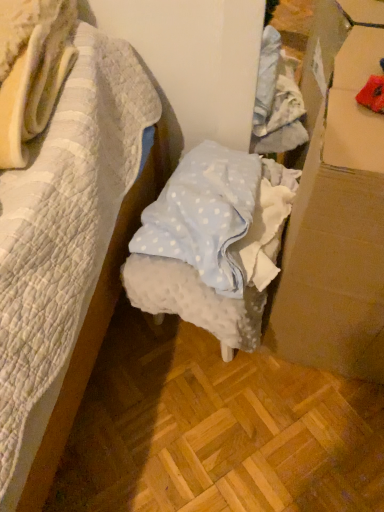
The width and height of the screenshot is (384, 512). What do you see at coordinates (337, 207) in the screenshot? I see `cardboard at right` at bounding box center [337, 207].

Where is `cardboard at right`? The height and width of the screenshot is (512, 384). cardboard at right is located at coordinates (337, 207).

Describe the element at coordinates (212, 243) in the screenshot. The width and height of the screenshot is (384, 512). I see `white dotted fabric at center` at that location.

Locate an element on the screen. white dotted fabric at center is located at coordinates (212, 243).

Identify the location of cardboard at right. (337, 207).

Is white dotted fabric at center to the left of cardboard at right from the viewer's perspective?

Indeed, white dotted fabric at center is positioned on the left side of cardboard at right.

In the image, is white dotted fabric at center positioned in front of or behind cardboard at right?

Visually, white dotted fabric at center is located behind cardboard at right.

Is point (212, 210) in front of point (342, 142)?

No, it is behind (342, 142).

From the image's perspective, is white dotted fabric at center on top of cardboard at right?

Indeed, from the image's perspective, white dotted fabric at center is shown above cardboard at right.

From a real-world perspective, which is physically below, white dotted fabric at center or cardboard at right?

white dotted fabric at center, from a real-world perspective.

Is white dotted fabric at center wider or thinner than cardboard at right?

white dotted fabric at center is wider than cardboard at right.

Is white dotted fabric at center shorter than cardboard at right?

Yes.

Between white dotted fabric at center and cardboard at right, which one has larger size?

cardboard at right.

Does white dotted fabric at center contain cardboard at right?

No, cardboard at right is not surrounded by white dotted fabric at center.

Are white dotted fabric at center and cardboard at right beside each other?

No, white dotted fabric at center is not with cardboard at right.

Could you tell me if white dotted fabric at center is turned towards cardboard at right?

No, white dotted fabric at center is not facing towards cardboard at right.

The image size is (384, 512). Identify the location of cardboard box above the white dotted fabric at center (from a real-world perspective). (337, 207).

Looking at this image, which object is positioned more to the right, cardboard at right or white dotted fabric at center?

Positioned to the right is cardboard at right.

In the image, is cardboard at right positioned in front of or behind white dotted fabric at center?

Clearly, cardboard at right is in front of white dotted fabric at center.

Is point (349, 124) behind point (230, 293)?

That is False.

Consider the image. From the image's perspective, is cardboard at right above or below white dotted fabric at center?

cardboard at right is below white dotted fabric at center.

From a real-world perspective, is cardboard at right located beneath white dotted fabric at center?

No, from a real-world perspective, cardboard at right is not under white dotted fabric at center.

In terms of width, does cardboard at right look wider or thinner when compared to white dotted fabric at center?

Clearly, cardboard at right has less width compared to white dotted fabric at center.

In terms of height, does cardboard at right look taller or shorter compared to white dotted fabric at center?

In the image, cardboard at right appears to be taller than white dotted fabric at center.

Considering the sizes of objects cardboard at right and white dotted fabric at center in the image provided, who is bigger, cardboard at right or white dotted fabric at center?

With larger size is cardboard at right.

Is white dotted fabric at center located within cardboard at right?

That's incorrect, white dotted fabric at center is not inside cardboard at right.

Is cardboard at right not near white dotted fabric at center?

No, cardboard at right is in close proximity to white dotted fabric at center.

Is cardboard at right facing towards white dotted fabric at center?

No, cardboard at right is not aimed at white dotted fabric at center.

How many degrees apart are the facing directions of cardboard at right and white dotted fabric at center?

6.19 degrees separate the facing orientations of cardboard at right and white dotted fabric at center.

Measure the distance from cardboard at right to white dotted fabric at center.

7.02 inches.

What are the coordinates of `furniture lying on the left of cardboard at right` in the screenshot? It's located at coord(212,243).

In order to click on furniture below the cardboard at right (from a real-world perspective) in this screenshot , I will do `click(212, 243)`.

Find the location of a particular element. The width and height of the screenshot is (384, 512). cardboard box below the white dotted fabric at center (from the image's perspective) is located at coordinates (337, 207).